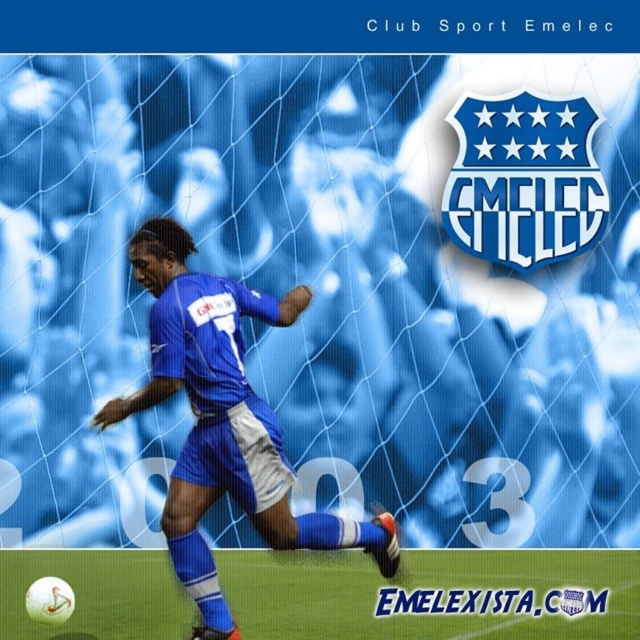
Question: Which point is farther to the camera?

Choices:
 (A) green grass at center
 (B) blue fabric soccer player at center

Answer: (A)

Question: Which of the following is the farthest from the observer?

Choices:
 (A) green grass at center
 (B) blue fabric soccer player at center

Answer: (A)

Question: Can you confirm if green grass at center is smaller than blue fabric soccer player at center?

Choices:
 (A) yes
 (B) no

Answer: (A)

Question: In this image, where is green grass at center located relative to blue fabric soccer player at center?

Choices:
 (A) left
 (B) right

Answer: (B)

Question: Can you confirm if green grass at center is positioned below blue fabric soccer player at center?

Choices:
 (A) yes
 (B) no

Answer: (A)